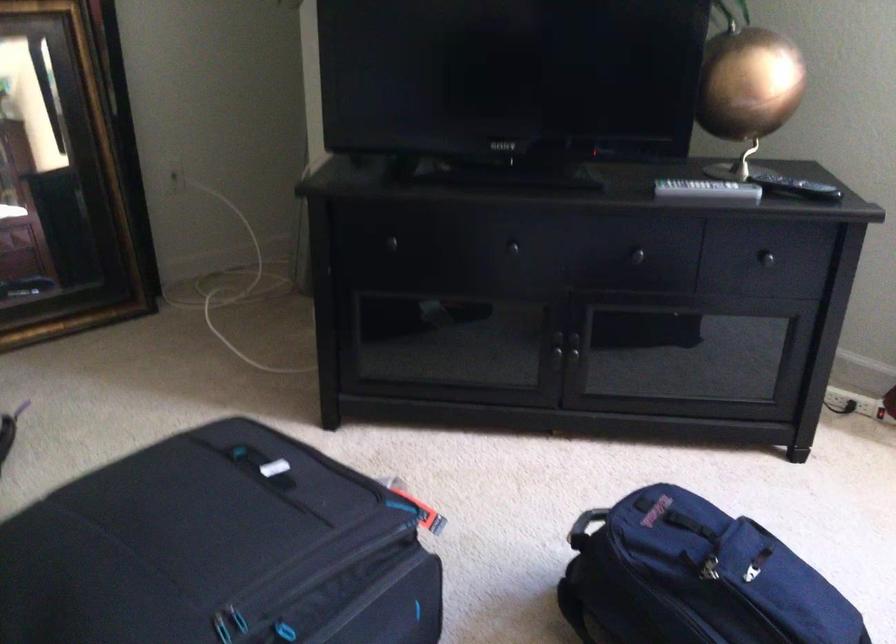
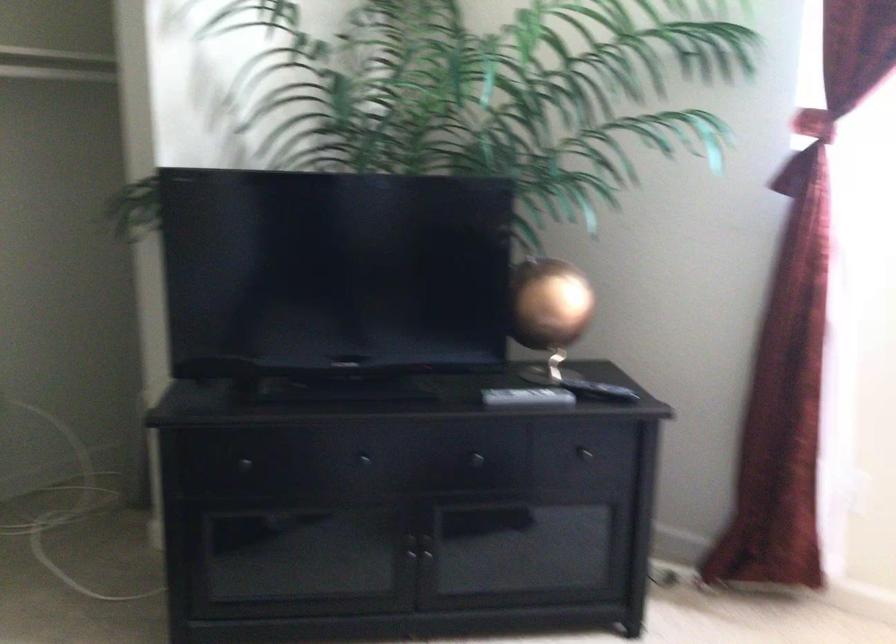
In the second image, find the point that corresponds to the point at 511,251 in the first image.

(362, 462)